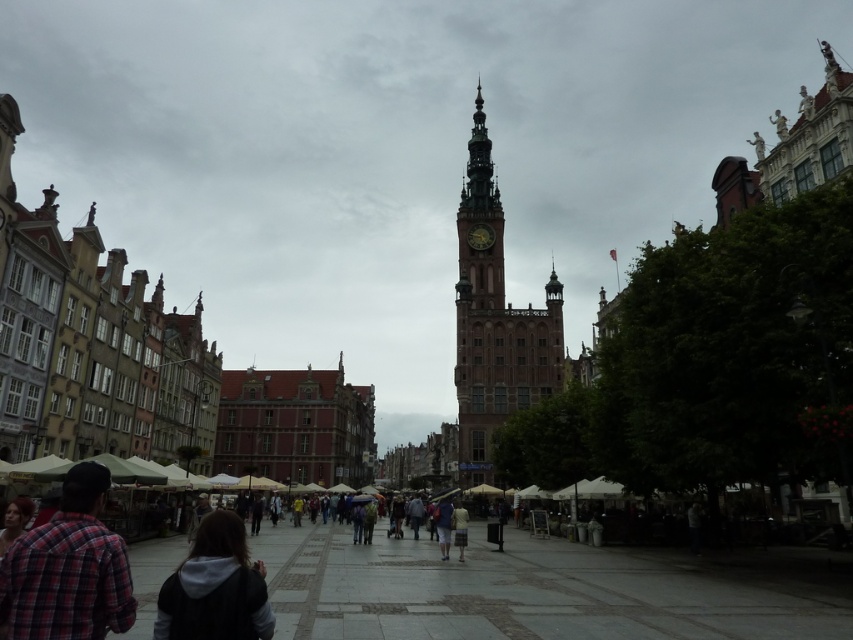
Question: Observing the image, what is the correct spatial positioning of plaid shirt at lower left in reference to dark gray hoodie at lower center?

Choices:
 (A) right
 (B) left

Answer: (B)

Question: In this image, where is plaid shirt at lower left located relative to dark gray hoodie at lower center?

Choices:
 (A) left
 (B) right

Answer: (A)

Question: Which point is farther to the camera?

Choices:
 (A) plaid shirt at lower left
 (B) golden stone clock tower at center

Answer: (B)

Question: Can you confirm if plaid shirt at lower left is wider than dark gray hoodie at lower center?

Choices:
 (A) no
 (B) yes

Answer: (A)

Question: Which object is farther from the camera taking this photo?

Choices:
 (A) plaid shirt at lower left
 (B) dark gray hoodie at lower center
 (C) golden stone clock tower at center

Answer: (C)

Question: Estimate the real-world distances between objects in this image. Which object is farther from the dark gray hoodie at lower center?

Choices:
 (A) golden stone clock tower at center
 (B) plaid shirt at lower left

Answer: (A)